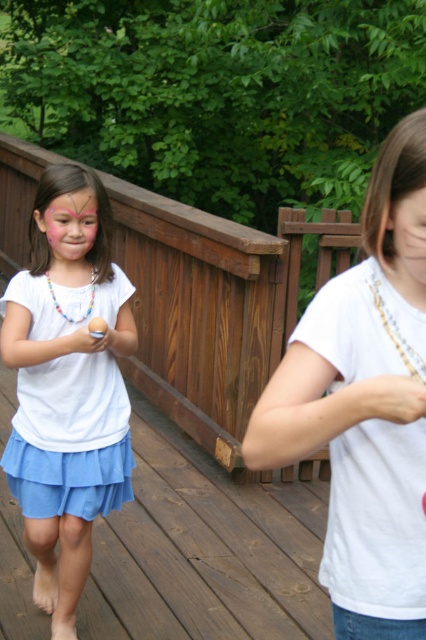
From the picture: You are an artist observing the scene and want to paint the white matte shirt at center and the matte white hand at center. Which object would require a wider brush stroke to cover its entire width?

The white matte shirt at center has a larger width than the matte white hand at center, so the white matte shirt at center would require a wider brush stroke to cover its entire width.

Consider the image. You are a photographer trying to capture a closeup of the multicolored beaded necklace at left. You notice the matte white hand at center is blocking your view. Can you move the hand to get a clear shot?

The matte white hand at center is closer to the viewer than the multicolored beaded necklace at left, so moving the hand would allow the photographer to capture the necklace without obstruction.